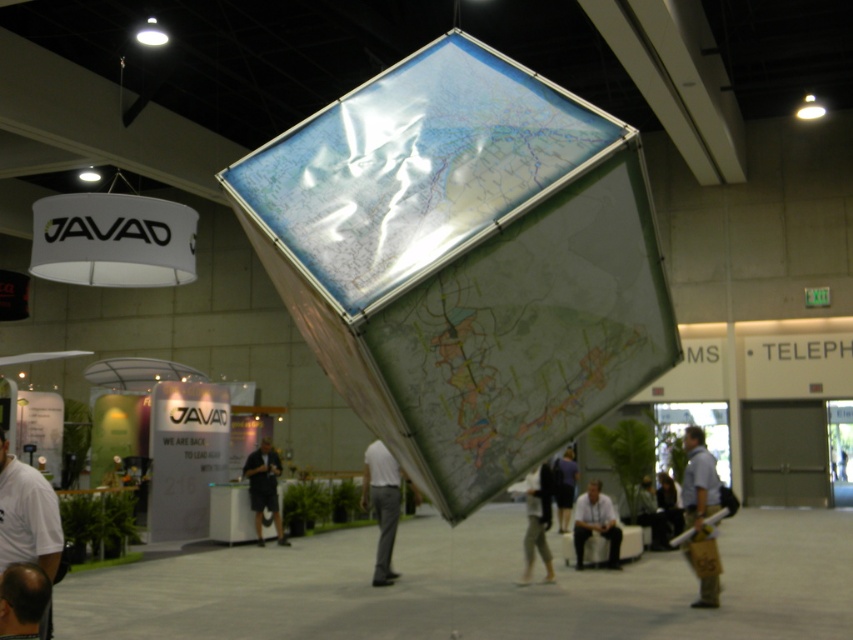
You are an attendee at the exhibition. You notice a person wearing a light blue shirt at lower right and khaki pants at center. Which clothing item is positioned higher on their body?

The light blue shirt at lower right is above khaki pants at center, so the light blue shirt at lower right is positioned higher on their body.

You are a photographer at the event and want to capture both the light blue shirt at lower right and the khaki pants at center in a single frame. Which clothing item should you focus on first to ensure both are in focus?

The light blue shirt at lower right is smaller in size compared to the khaki pants at center, so focusing on the khaki pants at center first would help maintain focus on both items since they are closer in size and distance.